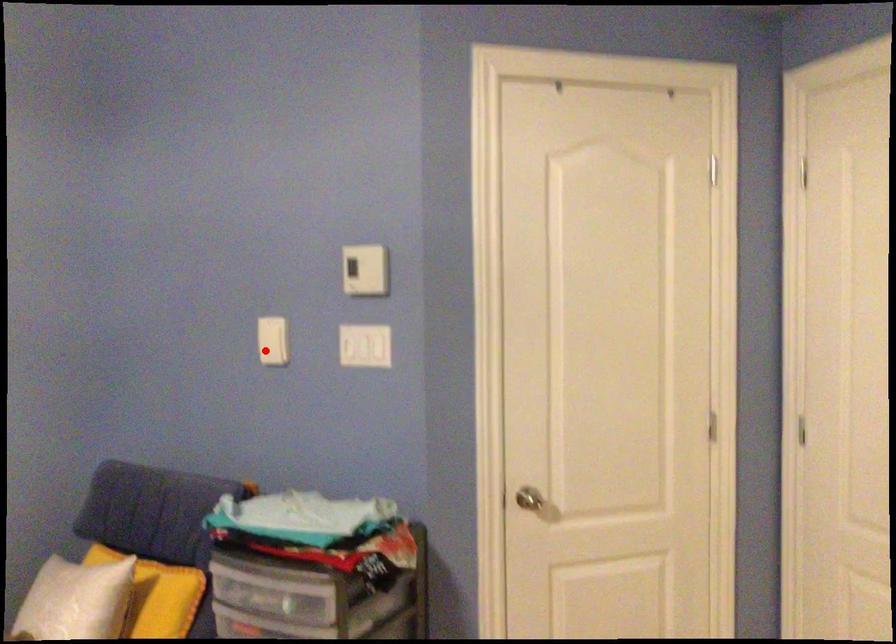
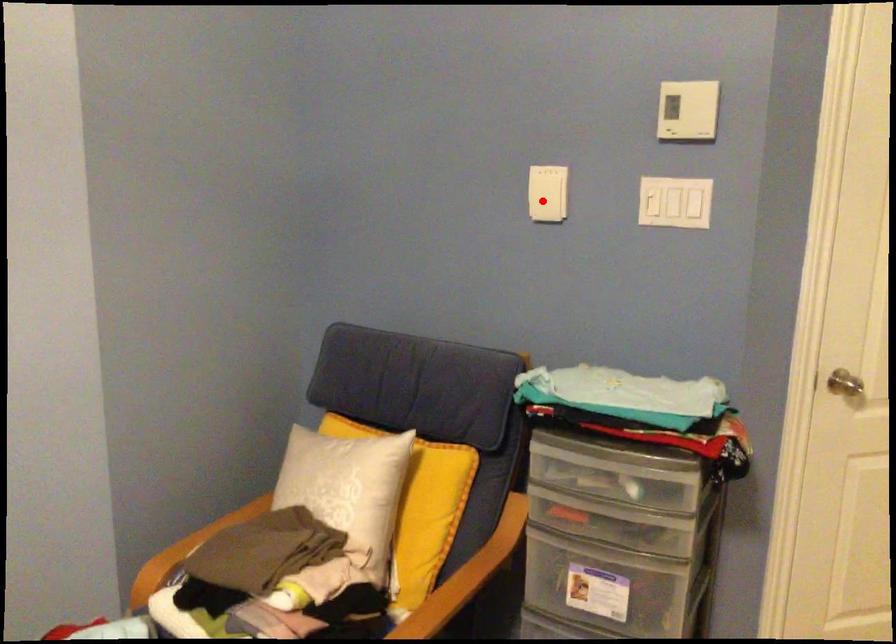
I am providing you with two images of the same scene from different viewpoints. A red point is marked on the first image and another point is marked on the second image. Is the marked point in image1 the same physical position as the marked point in image2?

Yes